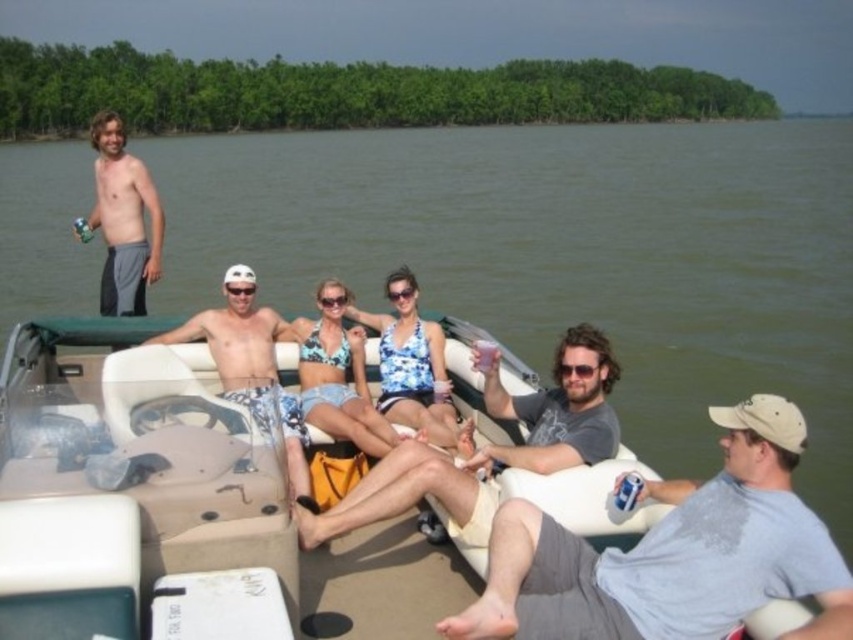
Who is lower down, green water at upper center or shiny gray shorts at left?

shiny gray shorts at left is lower down.

I want to click on green water at upper center, so click(563, 256).

Describe the element at coordinates (563, 256) in the screenshot. I see `green water at upper center` at that location.

Between green water at upper center and blue floral swimsuit at center, which one is positioned lower?

blue floral swimsuit at center

Which is behind, point (711, 152) or point (402, 332)?

The point (711, 152) is more distant.

Image resolution: width=853 pixels, height=640 pixels. Find the location of `green water at upper center`. green water at upper center is located at coordinates (563, 256).

In the scene shown: Who is taller, green water at upper center or gray cotton t-shirt at lower right?

green water at upper center is taller.

Who is more distant from viewer, (x=663, y=468) or (x=643, y=580)?

Point (x=663, y=468)

I want to click on green water at upper center, so click(x=563, y=256).

The image size is (853, 640). I want to click on green water at upper center, so click(563, 256).